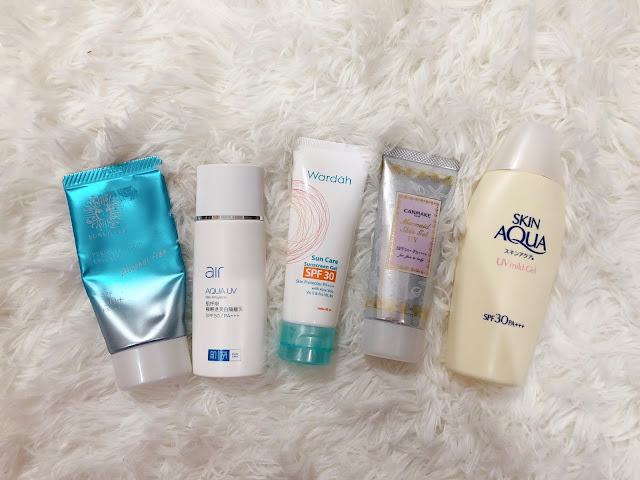
Locate an element on the screen. toiletry bottles laying on area is located at coordinates (180, 76).